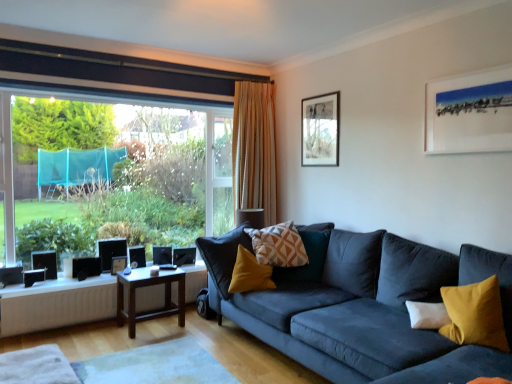
Question: Does point (134, 322) appear closer or farther from the camera than point (22, 314)?

Choices:
 (A) farther
 (B) closer

Answer: (A)

Question: From their relative heights in the image, would you say brown wooden table at center, the first table when ordered from bottom to top, is taller or shorter than wooden table at lower center, acting as the 1th table starting from the top?

Choices:
 (A) tall
 (B) short

Answer: (A)

Question: Which object is the farthest from the matte black picture frame at center, placed as the first picture frame when sorted from back to front?

Choices:
 (A) matte white picture frame at upper right, the first picture frame from the right
 (B) white matte radiator at lower left
 (C) geometric-patterned fabric pillow at center, the 2th pillow when ordered from right to left
 (D) transparent glass window at left
 (E) black plastic speaker at lower left, which appears as the first speaker when viewed from the front

Answer: (A)

Question: Which is farther from the wooden table at lower center, which appears as the second table when ordered from the bottom?

Choices:
 (A) black matte speaker at lower left, positioned as the second speaker in right-to-left order
 (B) matte black picture frame at upper center, which appears as the first picture frame when viewed from the top
 (C) white matte radiator at lower left
 (D) matte black picture frame at center, arranged as the 3th picture frame when viewed from the front
 (E) transparent glass window at left

Answer: (B)